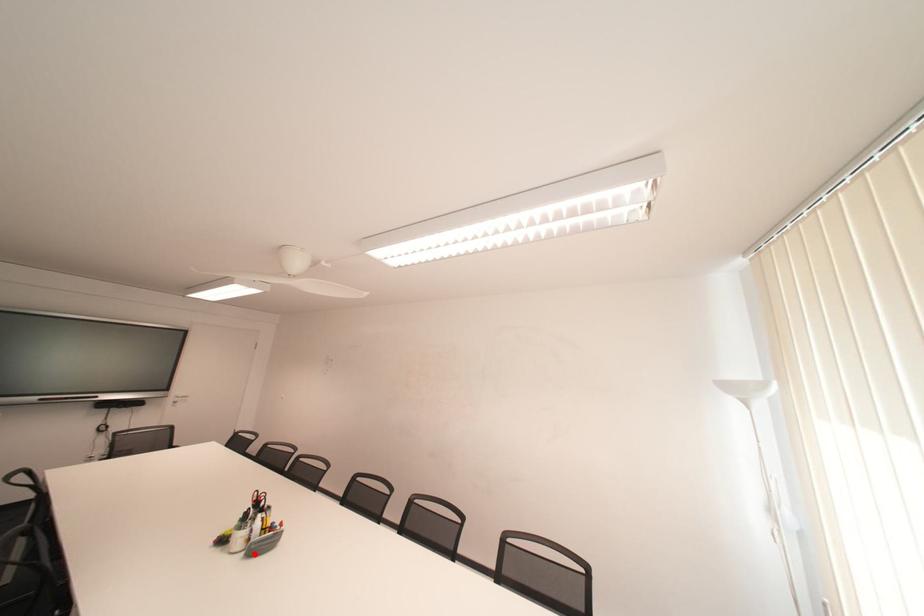
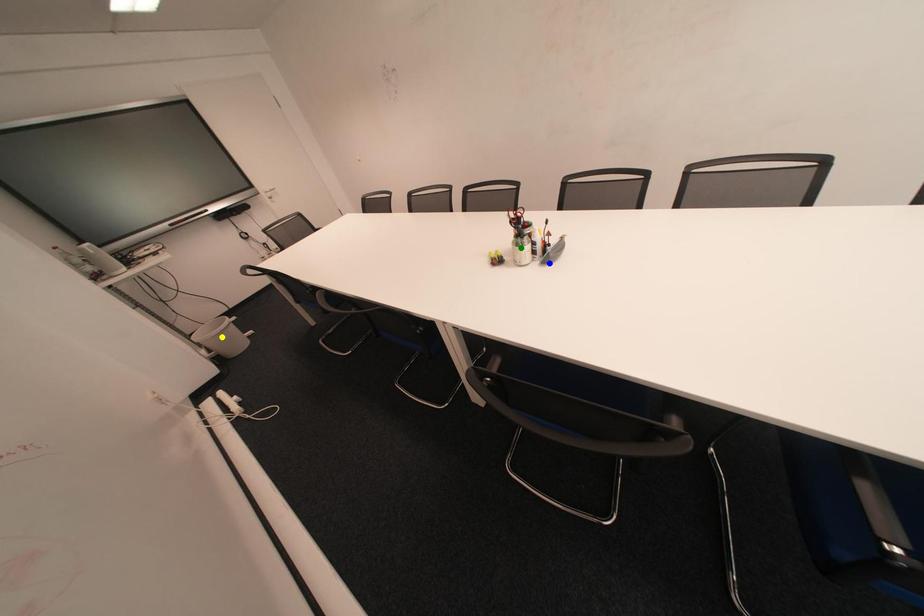
Question: I am providing you with two images of the same scene from different viewpoints. A red point is marked on the first image. You are given multiple points on the second image. In image 2, which mark is for the same physical point as the one in image 1?

Choices:
 (A) green point
 (B) yellow point
 (C) blue point

Answer: (C)